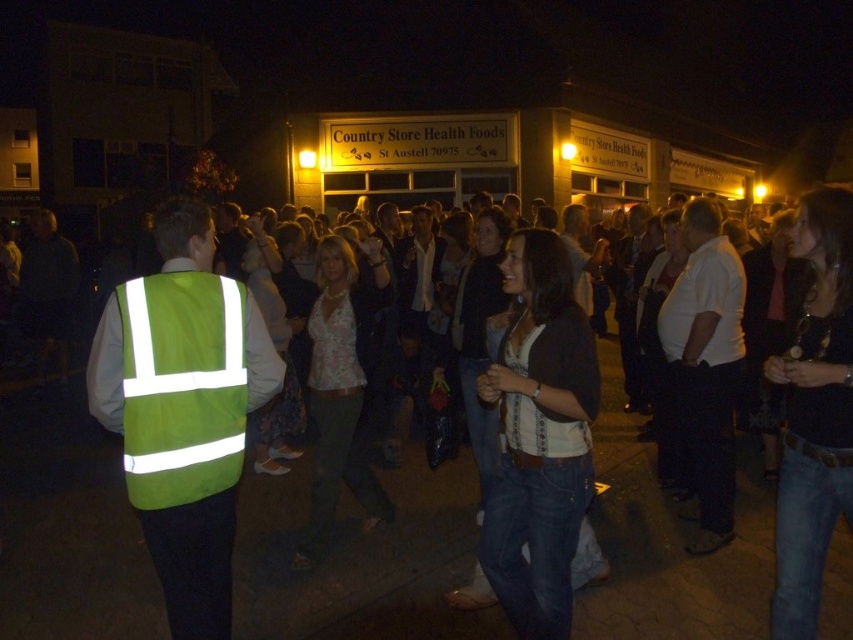
You are standing at the origin point in the image. Which direction should you move to reach the jeans at center?

The jeans at center is located at point 0.877 on the x axis and 0.424 on the y axis, so you should move towards the right and slightly forward to reach it.